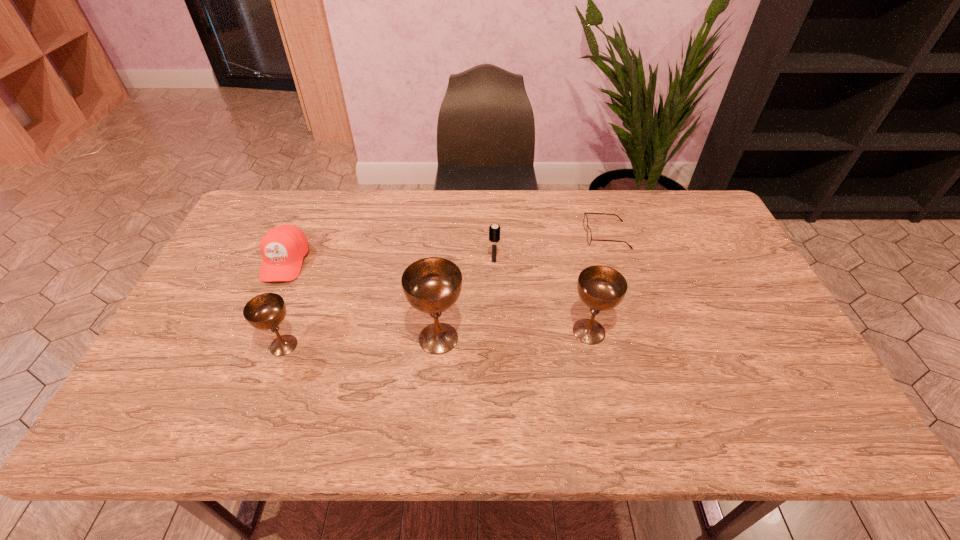
Image resolution: width=960 pixels, height=540 pixels. I want to click on free area in between the tallest chalice and the shortest object, so click(522, 287).

Where is `object identified as the closest to the shortest chalice`? object identified as the closest to the shortest chalice is located at coordinates (283, 248).

What are the coordinates of `object that is the fifth closest to the hairbrush` in the screenshot? It's located at click(283, 248).

Locate which chalice ranks second in proximity to the shortest object. Please provide its 2D coordinates. Your answer should be formatted as a tuple, i.e. [(x, y)], where the tuple contains the x and y coordinates of a point satisfying the conditions above.

[(432, 285)]

Select which chalice is the third closest to the shortest object. Please provide its 2D coordinates. Your answer should be formatted as a tuple, i.e. [(x, y)], where the tuple contains the x and y coordinates of a point satisfying the conditions above.

[(266, 311)]

Locate an element on the screen. The height and width of the screenshot is (540, 960). vacant space that satisfies the following two spatial constraints: 1. on the front panel of the baseball cap; 2. on the left side of the second chalice from right to left is located at coordinates (252, 338).

In order to click on vacant space that satisfies the following two spatial constraints: 1. on the back side of the tallest object; 2. on the left side of the rightmost chalice in this screenshot , I will do `click(439, 332)`.

Identify the location of vacant space that satisfies the following two spatial constraints: 1. on the back side of the rightmost chalice; 2. on the left side of the shortest chalice. The image size is (960, 540). (289, 332).